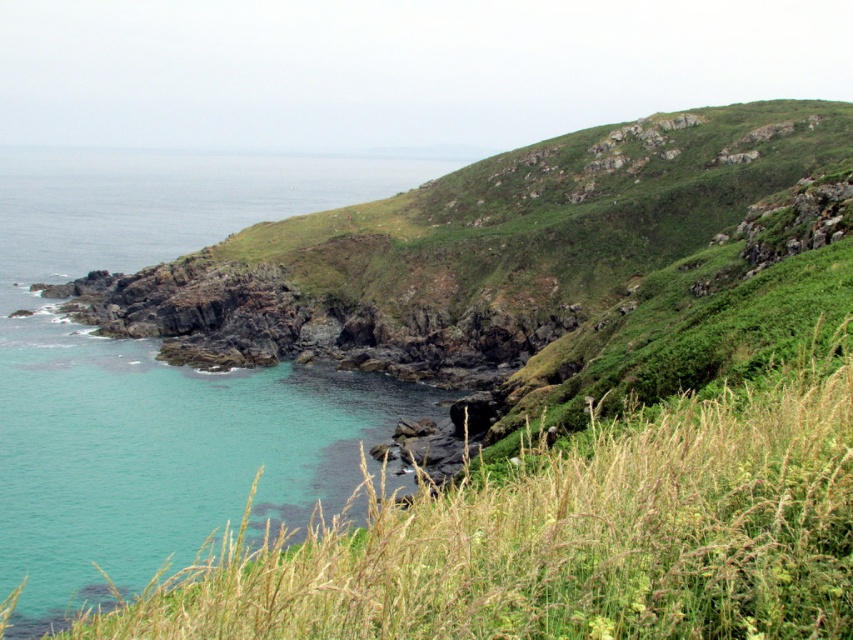
You are standing at the point marked by point (570, 536) in the coastal landscape. Looking around, you see the green grassy area at lower left and the rocky cliffs ahead. Which direction should you walk to reach the rocky cliffs?

The point (570, 536) represents the green grassy area at lower left. To reach the rocky cliffs ahead, you should walk towards the upper right direction away from the green grassy area at lower left.

You are standing at the center of the image. Which direction should you walk to reach the green grassy at lower left?

You should walk towards the lower left direction to reach the green grassy at lower left.